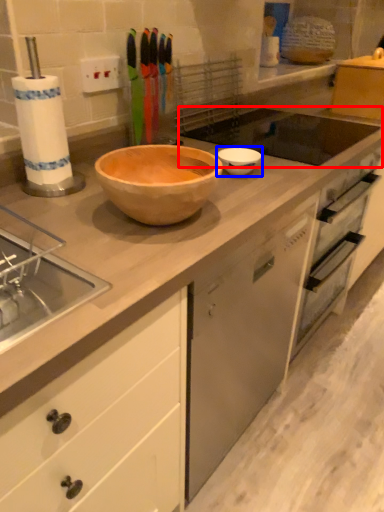
Question: Which point is further to the camera, sink (highlighted by a red box) or basin (highlighted by a blue box)?

Choices:
 (A) sink
 (B) basin

Answer: (A)